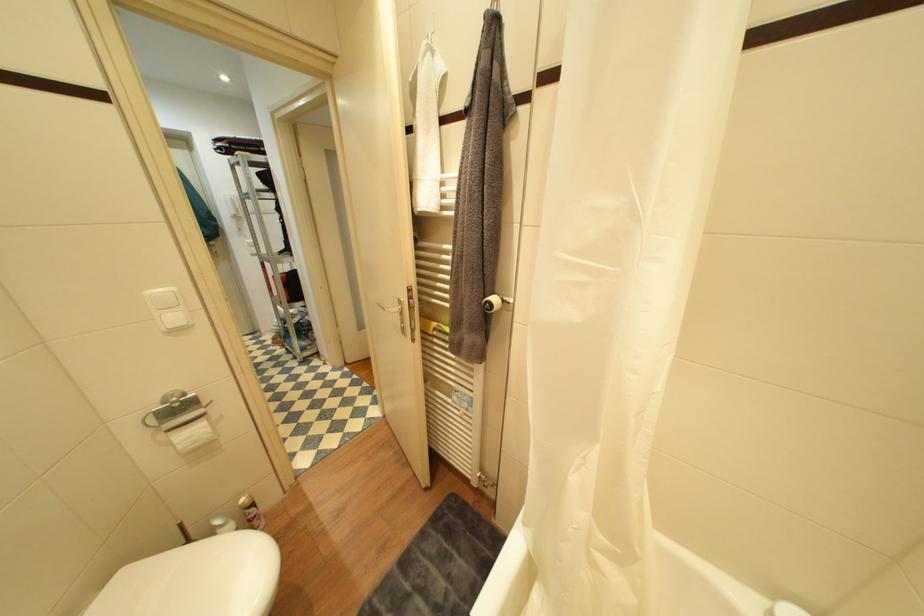
This screenshot has height=616, width=924. Describe the element at coordinates (494, 302) in the screenshot. I see `a toilet paper holder` at that location.